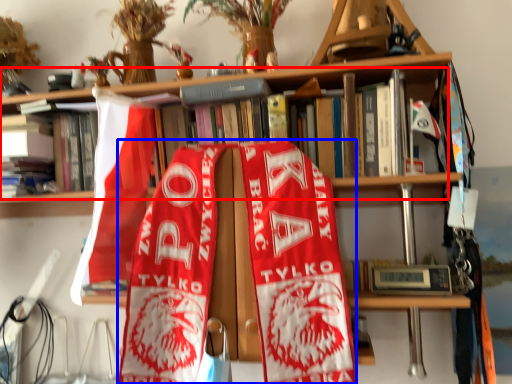
Question: Which object appears closest to the camera in this image, book (highlighted by a red box) or beach towel (highlighted by a blue box)?

Choices:
 (A) book
 (B) beach towel

Answer: (B)